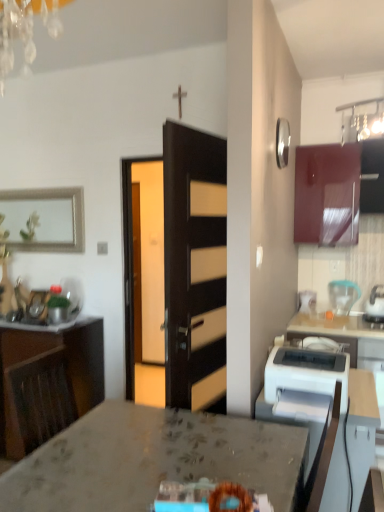
Question: Considering the relative sizes of white glossy table at lower right and wooden cabinet at left, placed as the second cabinetry when sorted from right to left, in the image provided, is white glossy table at lower right shorter than wooden cabinet at left, placed as the second cabinetry when sorted from right to left,?

Choices:
 (A) yes
 (B) no

Answer: (A)

Question: Considering the relative sizes of white glossy table at lower right and wooden cabinet at left, which is the second cabinetry in top-to-bottom order, in the image provided, is white glossy table at lower right wider than wooden cabinet at left, which is the second cabinetry in top-to-bottom order,?

Choices:
 (A) yes
 (B) no

Answer: (A)

Question: Is wooden cabinet at left, placed as the second cabinetry when sorted from right to left, completely or partially inside white glossy table at lower right?

Choices:
 (A) yes
 (B) no

Answer: (B)

Question: Is white glossy table at lower right not near wooden cabinet at left, the 1th cabinetry in the bottom-to-top sequence?

Choices:
 (A) yes
 (B) no

Answer: (A)

Question: From the image's perspective, is white glossy table at lower right above wooden cabinet at left, placed as the first cabinetry when sorted from left to right?

Choices:
 (A) yes
 (B) no

Answer: (B)

Question: Considering their positions, is wooden cabinet at left, placed as the first cabinetry when sorted from left to right, located in front of or behind marble countertop at center?

Choices:
 (A) front
 (B) behind

Answer: (B)

Question: In terms of width, does wooden cabinet at left, placed as the second cabinetry when sorted from right to left, look wider or thinner when compared to marble countertop at center?

Choices:
 (A) thin
 (B) wide

Answer: (A)

Question: From a real-world perspective, is wooden cabinet at left, which is the second cabinetry in top-to-bottom order, above or below marble countertop at center?

Choices:
 (A) above
 (B) below

Answer: (B)

Question: Considering the positions of wooden cabinet at left, which is the second cabinetry in top-to-bottom order, and marble countertop at center in the image, is wooden cabinet at left, which is the second cabinetry in top-to-bottom order, bigger or smaller than marble countertop at center?

Choices:
 (A) small
 (B) big

Answer: (A)

Question: From the image's perspective, is translucent plastic blender at right, marked as the 1th kitchen appliance in a back-to-front arrangement, above or below marble countertop at center?

Choices:
 (A) above
 (B) below

Answer: (A)

Question: Considering the positions of translucent plastic blender at right, marked as the 1th kitchen appliance in a back-to-front arrangement, and marble countertop at center in the image, is translucent plastic blender at right, marked as the 1th kitchen appliance in a back-to-front arrangement, wider or thinner than marble countertop at center?

Choices:
 (A) wide
 (B) thin

Answer: (B)

Question: Relative to marble countertop at center, is translucent plastic blender at right, marked as the 1th kitchen appliance in a back-to-front arrangement, in front or behind?

Choices:
 (A) behind
 (B) front

Answer: (A)

Question: Is translucent plastic blender at right, marked as the 1th kitchen appliance in a back-to-front arrangement, inside or outside of marble countertop at center?

Choices:
 (A) inside
 (B) outside

Answer: (B)

Question: In the image, is marble countertop at center positioned in front of or behind silver metallic picture frame at upper left?

Choices:
 (A) front
 (B) behind

Answer: (A)

Question: In terms of height, does marble countertop at center look taller or shorter compared to silver metallic picture frame at upper left?

Choices:
 (A) tall
 (B) short

Answer: (A)